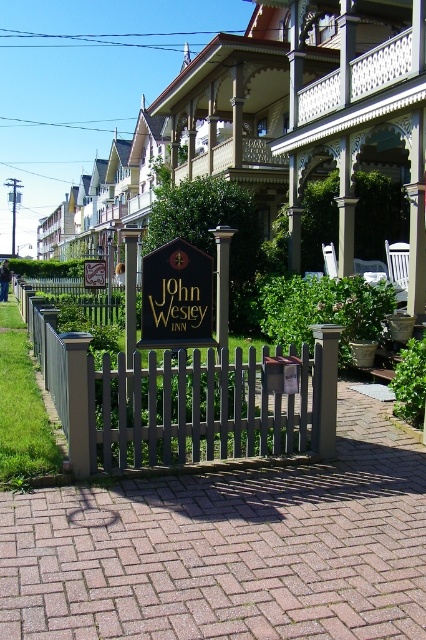
You are standing in front of the John Wesley Inn and want to know how far the point at coordinates (x=308, y=388) is from your current position. Can you determine the distance?

The point at coordinates (x=308, y=388) is 8.63 meters away from your current position.